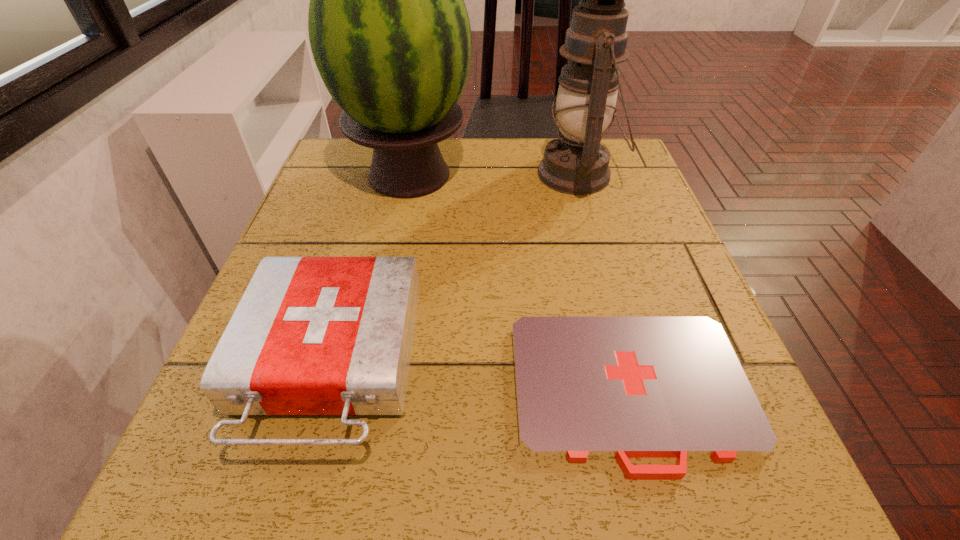
Find the location of a particular element. Image resolution: width=960 pixels, height=540 pixels. watermelon is located at coordinates (389, 31).

At what (x,y) coordinates should I click in order to perform the action: click on oil lamp. Please return your answer as a coordinate pair (x, y). The width and height of the screenshot is (960, 540). Looking at the image, I should click on (577, 163).

The image size is (960, 540). Find the location of `the left first-aid kit`. the left first-aid kit is located at coordinates (311, 335).

At what (x,y) coordinates should I click in order to perform the action: click on the second shortest object. Please return your answer as a coordinate pair (x, y). Looking at the image, I should click on (311, 335).

Where is `the right first-aid kit`? The image size is (960, 540). the right first-aid kit is located at coordinates (586, 387).

What are the coordinates of `the shortest object` in the screenshot? It's located at (586, 387).

Where is `vacant space positioned on the front of the watermelon`? The image size is (960, 540). vacant space positioned on the front of the watermelon is located at coordinates (396, 241).

Find the location of a particular element. The image size is (960, 540). free region located 0.110m on the left of the oil lamp is located at coordinates (492, 174).

Where is `watermelon that is at the far edge`? The image size is (960, 540). watermelon that is at the far edge is located at coordinates (389, 31).

The width and height of the screenshot is (960, 540). I want to click on oil lamp that is at the far edge, so click(577, 163).